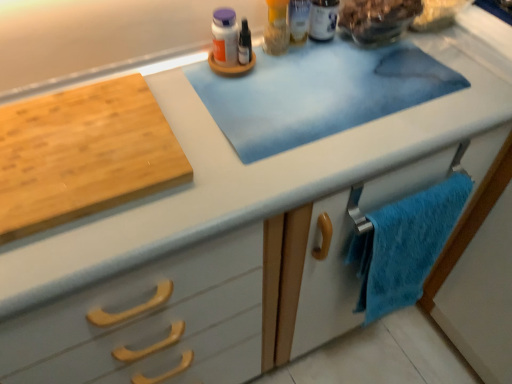
The image size is (512, 384). What do you see at coordinates (323, 19) in the screenshot?
I see `white plastic bottle at upper center, marked as the 1th toiletry in a right-to-left arrangement` at bounding box center [323, 19].

Image resolution: width=512 pixels, height=384 pixels. In order to click on natural wood cutting board at left in this screenshot , I will do `click(83, 154)`.

Image resolution: width=512 pixels, height=384 pixels. What do you see at coordinates (405, 245) in the screenshot?
I see `blue fuzzy towel at lower right` at bounding box center [405, 245].

Describe the element at coordinates (377, 19) in the screenshot. I see `translucent glass bowl at upper right` at that location.

What is the approximate width of translucent plastic container at upper center, arranged as the 2th toiletry when viewed from the right?

The width of translucent plastic container at upper center, arranged as the 2th toiletry when viewed from the right, is 3.33 inches.

Where is `white plastic bottle at upper center, which appears as the 2th toiletry when viewed from the left`? The height and width of the screenshot is (384, 512). white plastic bottle at upper center, which appears as the 2th toiletry when viewed from the left is located at coordinates pyautogui.click(x=323, y=19).

From a real-world perspective, is translucent glass bowl at upper right physically located above or below blue fuzzy towel at lower right?

translucent glass bowl at upper right is situated higher than blue fuzzy towel at lower right in the real world.

Consider the image. From the image's perspective, is translucent glass bowl at upper right positioned above or below blue fuzzy towel at lower right?

translucent glass bowl at upper right is situated higher than blue fuzzy towel at lower right in the image.

Considering the sizes of translucent glass bowl at upper right and blue fuzzy towel at lower right in the image, is translucent glass bowl at upper right bigger or smaller than blue fuzzy towel at lower right?

Clearly, translucent glass bowl at upper right is smaller in size than blue fuzzy towel at lower right.

From a real-world perspective, is natural wood cutting board at left on translucent glass bowl at upper right?

No, from a real-world perspective, natural wood cutting board at left is not on top of translucent glass bowl at upper right.

From the image's perspective, is natural wood cutting board at left located above or below translucent glass bowl at upper right?

Based on their image positions, natural wood cutting board at left is located beneath translucent glass bowl at upper right.

The width and height of the screenshot is (512, 384). What are the coordinates of `cutting board in front of the translucent glass bowl at upper right` in the screenshot? It's located at (83, 154).

How far apart are natural wood cutting board at left and translucent glass bowl at upper right?

The distance of natural wood cutting board at left from translucent glass bowl at upper right is 20.53 inches.

Identify the location of bath towel in front of the white plastic bottle at upper center, marked as the 1th toiletry in a right-to-left arrangement. (405, 245).

Can you see white plastic bottle at upper center, marked as the 1th toiletry in a right-to-left arrangement, touching blue fuzzy towel at lower right?

They are not placed beside each other.

From the image's perspective, which one is positioned lower, white plastic bottle at upper center, which appears as the 2th toiletry when viewed from the left, or blue fuzzy towel at lower right?

blue fuzzy towel at lower right is shown below in the image.

Looking at this image, who is smaller, white plastic bottle at upper center, marked as the 1th toiletry in a right-to-left arrangement, or blue fuzzy towel at lower right?

Smaller between the two is white plastic bottle at upper center, marked as the 1th toiletry in a right-to-left arrangement.

Can you confirm if translucent plastic container at upper center, placed as the 1th toiletry when sorted from left to right, is positioned to the right of blue fuzzy towel at lower right?

Incorrect, translucent plastic container at upper center, placed as the 1th toiletry when sorted from left to right, is not on the right side of blue fuzzy towel at lower right.

Is blue fuzzy towel at lower right completely or partially inside translucent plastic container at upper center, arranged as the 2th toiletry when viewed from the right?

No, blue fuzzy towel at lower right is not a part of translucent plastic container at upper center, arranged as the 2th toiletry when viewed from the right.

Identify the location of the 1st toiletry positioned above the blue fuzzy towel at lower right (from the image's perspective). (277, 28).

Which object is more forward, translucent plastic container at upper center, placed as the 1th toiletry when sorted from left to right, or blue fuzzy towel at lower right?

blue fuzzy towel at lower right is in front.

Is blue fuzzy towel at lower right located outside white plastic bottle at upper center, which appears as the 2th toiletry when viewed from the left?

Indeed, blue fuzzy towel at lower right is completely outside white plastic bottle at upper center, which appears as the 2th toiletry when viewed from the left.

Can you tell me how much blue fuzzy towel at lower right and white plastic bottle at upper center, which appears as the 2th toiletry when viewed from the left, differ in facing direction?

0.000761 degrees separate the facing orientations of blue fuzzy towel at lower right and white plastic bottle at upper center, which appears as the 2th toiletry when viewed from the left.

Would you consider blue fuzzy towel at lower right to be distant from white plastic bottle at upper center, which appears as the 2th toiletry when viewed from the left?

No, blue fuzzy towel at lower right is not far from white plastic bottle at upper center, which appears as the 2th toiletry when viewed from the left.

Which of these two, blue fuzzy towel at lower right or white plastic bottle at upper center, marked as the 1th toiletry in a right-to-left arrangement, is wider?

blue fuzzy towel at lower right.

Image resolution: width=512 pixels, height=384 pixels. I want to click on the 2nd toiletry behind the natural wood cutting board at left, so click(323, 19).

In the image, is natural wood cutting board at left positioned in front of or behind white plastic bottle at upper center, which appears as the 2th toiletry when viewed from the left?

In the image, natural wood cutting board at left appears in front of white plastic bottle at upper center, which appears as the 2th toiletry when viewed from the left.

In the scene shown: Considering the positions of objects natural wood cutting board at left and white plastic bottle at upper center, which appears as the 2th toiletry when viewed from the left, in the image provided, who is more to the left, natural wood cutting board at left or white plastic bottle at upper center, which appears as the 2th toiletry when viewed from the left,?

Positioned to the left is natural wood cutting board at left.

Based on the photo, does blue fuzzy towel at lower right have a greater height compared to natural wood cutting board at left?

Yes, blue fuzzy towel at lower right is taller than natural wood cutting board at left.

Is blue fuzzy towel at lower right facing away from natural wood cutting board at left?

No, natural wood cutting board at left is not at the back of blue fuzzy towel at lower right.

Does blue fuzzy towel at lower right have a smaller size compared to natural wood cutting board at left?

No.

The image size is (512, 384). Identify the location of cutting board in front of the blue fuzzy towel at lower right. (83, 154).

You are a GUI agent. You are given a task and a screenshot of the screen. Output one action in this format:
    pyautogui.click(x=<x>, y=<y>)
    Task: Click on the food above the blue fuzzy towel at lower right (from the image's perspective)
    The image size is (512, 384).
    Given the screenshot: What is the action you would take?
    pyautogui.click(x=377, y=19)

The width and height of the screenshot is (512, 384). I want to click on cutting board located below the translucent glass bowl at upper right (from the image's perspective), so click(x=83, y=154).

Based on the photo, from the image, which object appears to be nearer to natural wood cutting board at left, white plastic bottle at upper center, marked as the 1th toiletry in a right-to-left arrangement, or blue fuzzy towel at lower right?

blue fuzzy towel at lower right is closer to natural wood cutting board at left.

Based on their spatial positions, is blue fuzzy towel at lower right or white plastic bottle at upper center, marked as the 1th toiletry in a right-to-left arrangement, closer to translucent plastic container at upper center, placed as the 1th toiletry when sorted from left to right?

Based on the image, white plastic bottle at upper center, marked as the 1th toiletry in a right-to-left arrangement, appears to be nearer to translucent plastic container at upper center, placed as the 1th toiletry when sorted from left to right.

Considering their positions, is white plastic bottle at upper center, marked as the 1th toiletry in a right-to-left arrangement, positioned closer to natural wood cutting board at left than translucent plastic container at upper center, arranged as the 2th toiletry when viewed from the right?

translucent plastic container at upper center, arranged as the 2th toiletry when viewed from the right.

Based on their spatial positions, is white plastic bottle at upper center, marked as the 1th toiletry in a right-to-left arrangement, or translucent glass bowl at upper right further from blue fuzzy towel at lower right?

white plastic bottle at upper center, marked as the 1th toiletry in a right-to-left arrangement, is further to blue fuzzy towel at lower right.

Looking at the image, which one is located closer to white plastic bottle at upper center, which appears as the 2th toiletry when viewed from the left, blue fuzzy towel at lower right or translucent glass bowl at upper right?

translucent glass bowl at upper right is positioned closer to the anchor white plastic bottle at upper center, which appears as the 2th toiletry when viewed from the left.

Looking at this image, from the image, which object appears to be farther from natural wood cutting board at left, translucent plastic container at upper center, arranged as the 2th toiletry when viewed from the right, or blue fuzzy towel at lower right?

blue fuzzy towel at lower right is positioned further to the anchor natural wood cutting board at left.

Estimate the real-world distances between objects in this image. Which object is closer to white plastic bottle at upper center, marked as the 1th toiletry in a right-to-left arrangement, blue fuzzy towel at lower right or natural wood cutting board at left?

The object closer to white plastic bottle at upper center, marked as the 1th toiletry in a right-to-left arrangement, is blue fuzzy towel at lower right.

Considering their positions, is natural wood cutting board at left positioned closer to white plastic bottle at upper center, marked as the 1th toiletry in a right-to-left arrangement, than blue fuzzy towel at lower right?

Among the two, blue fuzzy towel at lower right is located nearer to white plastic bottle at upper center, marked as the 1th toiletry in a right-to-left arrangement.

What are the coordinates of `toiletry that lies between white plastic bottle at upper center, which appears as the 2th toiletry when viewed from the left, and blue fuzzy towel at lower right from top to bottom` in the screenshot? It's located at (277, 28).

You are a GUI agent. You are given a task and a screenshot of the screen. Output one action in this format:
    pyautogui.click(x=<x>, y=<y>)
    Task: Click on the toiletry situated between natural wood cutting board at left and white plastic bottle at upper center, marked as the 1th toiletry in a right-to-left arrangement, from left to right
    This screenshot has height=384, width=512.
    Given the screenshot: What is the action you would take?
    pyautogui.click(x=277, y=28)

Locate an element on the screen. This screenshot has height=384, width=512. toiletry located between translucent plastic container at upper center, placed as the 1th toiletry when sorted from left to right, and translucent glass bowl at upper right in the left-right direction is located at coordinates (323, 19).

Where is `food located between natural wood cutting board at left and blue fuzzy towel at lower right in the left-right direction`? The width and height of the screenshot is (512, 384). food located between natural wood cutting board at left and blue fuzzy towel at lower right in the left-right direction is located at coordinates (377, 19).